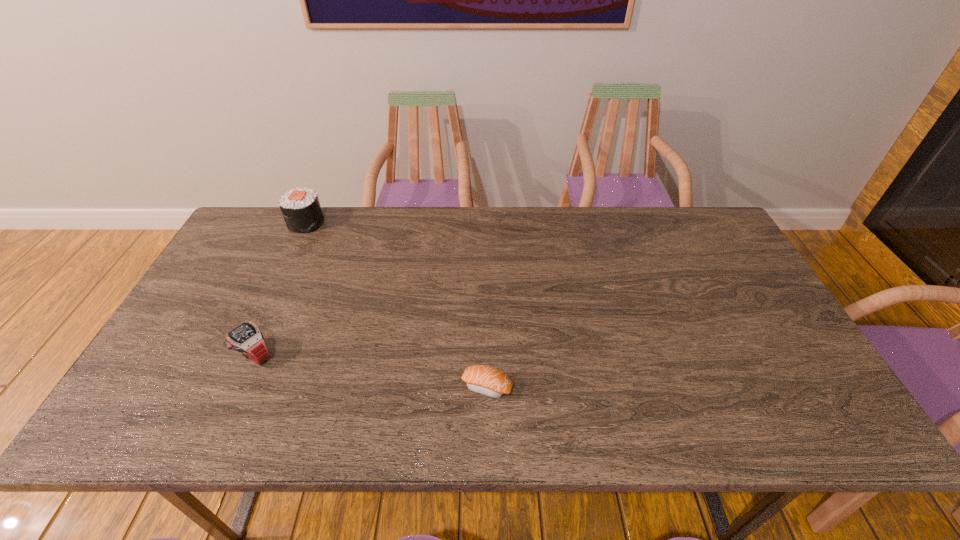
Where is `vacant area that lies between the taller sushi and the second nearest object`? vacant area that lies between the taller sushi and the second nearest object is located at coordinates (280, 289).

Where is `free space between the shorter sushi and the tallest object`? Image resolution: width=960 pixels, height=540 pixels. free space between the shorter sushi and the tallest object is located at coordinates (396, 305).

Find the location of `free space between the second shortest object and the nearer sushi`. free space between the second shortest object and the nearer sushi is located at coordinates (371, 371).

Identify the location of free area in between the farthest object and the right sushi. Image resolution: width=960 pixels, height=540 pixels. (396, 305).

Where is `free spot between the second nearest object and the farther sushi`? Image resolution: width=960 pixels, height=540 pixels. free spot between the second nearest object and the farther sushi is located at coordinates (280, 289).

Where is `blank region between the watch and the left sushi`? The height and width of the screenshot is (540, 960). blank region between the watch and the left sushi is located at coordinates (280, 289).

Where is `vacant region between the nearest object and the second farthest object`? vacant region between the nearest object and the second farthest object is located at coordinates (371, 371).

Point out which object is positioned as the nearest to the watch. Please provide its 2D coordinates. Your answer should be formatted as a tuple, i.e. [(x, y)], where the tuple contains the x and y coordinates of a point satisfying the conditions above.

[(301, 209)]

This screenshot has width=960, height=540. Identify the location of object that is the second closest to the tallest object. (485, 380).

Locate an element on the screen. This screenshot has height=540, width=960. vacant space that satisfies the following two spatial constraints: 1. on the front side of the second shortest object; 2. on the right side of the right sushi is located at coordinates (241, 387).